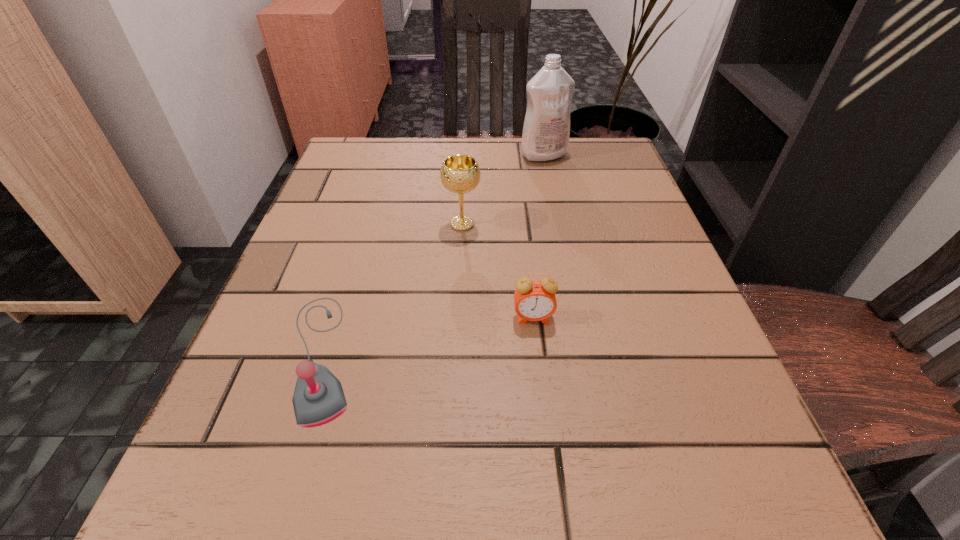
Where is `object that is the second closest to the leftmost object`? The image size is (960, 540). object that is the second closest to the leftmost object is located at coordinates (535, 300).

Locate which object is the closest to the alarm clock. Please provide its 2D coordinates. Your answer should be formatted as a tuple, i.e. [(x, y)], where the tuple contains the x and y coordinates of a point satisfying the conditions above.

[(460, 173)]